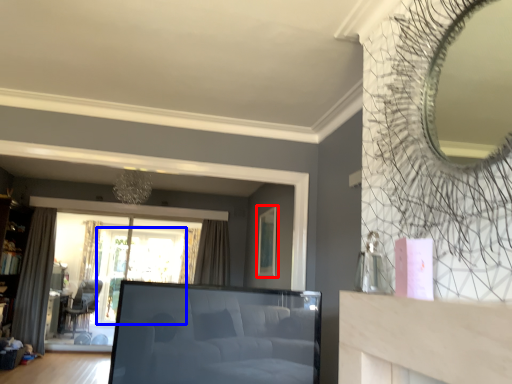
Question: Which object is further to the camera taking this photo, picture frame (highlighted by a red box) or window screen (highlighted by a blue box)?

Choices:
 (A) picture frame
 (B) window screen

Answer: (B)